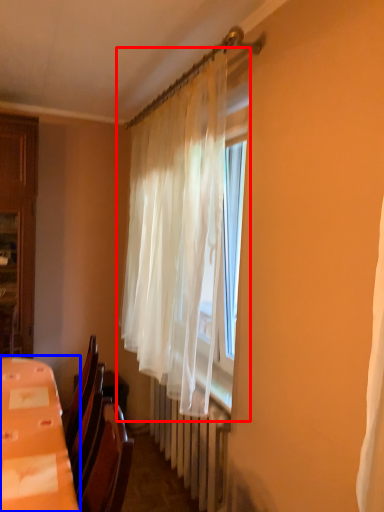
Question: Which point is closer to the camera, curtain (highlighted by a red box) or table (highlighted by a blue box)?

Choices:
 (A) curtain
 (B) table

Answer: (B)